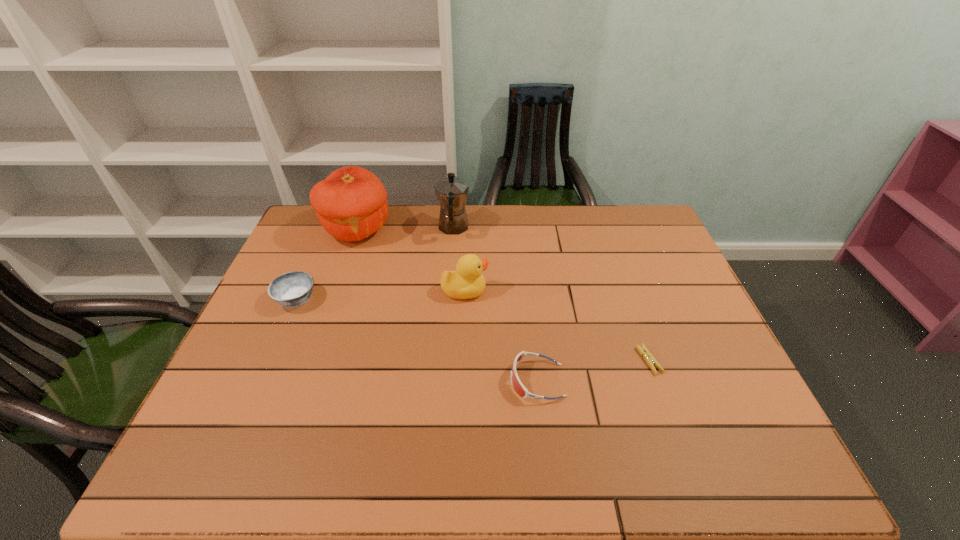
This screenshot has width=960, height=540. I want to click on vacant region between the rightmost object and the coffeepot, so click(551, 294).

Where is `vacant point located between the ashtray and the shortest object`? Image resolution: width=960 pixels, height=540 pixels. vacant point located between the ashtray and the shortest object is located at coordinates (472, 330).

The image size is (960, 540). Find the location of `empty location between the pumpkin and the ashtray`. empty location between the pumpkin and the ashtray is located at coordinates (326, 264).

Where is `vacant space in between the duck and the pumpkin`? The height and width of the screenshot is (540, 960). vacant space in between the duck and the pumpkin is located at coordinates (411, 260).

Locate an element on the screen. Image resolution: width=960 pixels, height=540 pixels. unoccupied area between the pumpkin and the clothespin is located at coordinates (503, 295).

Find the location of a particular element. This screenshot has height=540, width=960. vacant space that is in between the goggles and the ashtray is located at coordinates (417, 340).

Select which object is the fifth closest to the clothespin. Please provide its 2D coordinates. Your answer should be formatted as a tuple, i.e. [(x, y)], where the tuple contains the x and y coordinates of a point satisfying the conditions above.

[(292, 289)]

Find the location of a particular element. Image resolution: width=960 pixels, height=540 pixels. object that stands as the fourth closest to the pumpkin is located at coordinates (520, 389).

Locate an element on the screen. free space that satisfies the following two spatial constraints: 1. on the front side of the pumpkin; 2. on the right side of the rightmost object is located at coordinates (311, 361).

Identify the location of vacant space that satisfies the following two spatial constraints: 1. at the beak of the fourth shortest object; 2. on the back side of the clothespin. The image size is (960, 540). (462, 361).